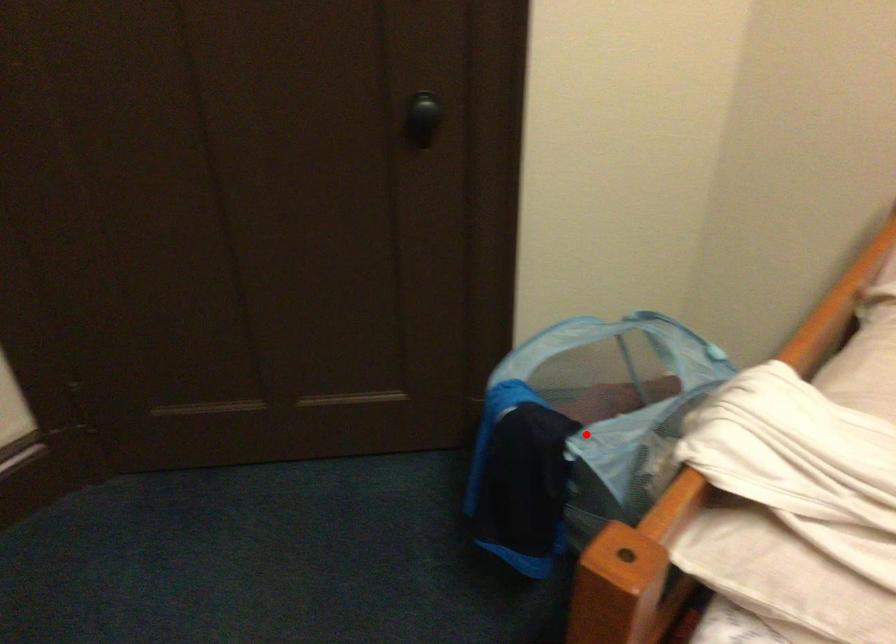
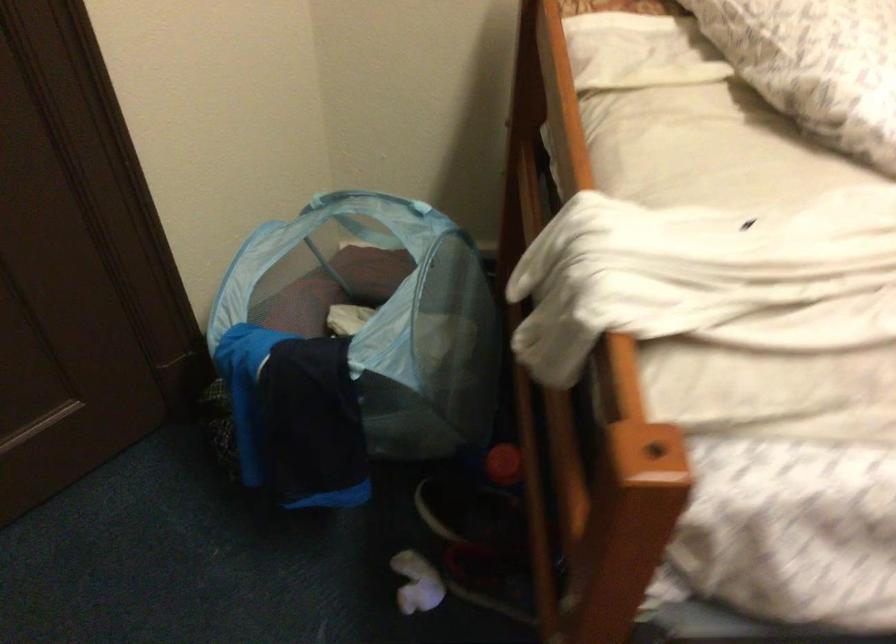
Question: I am providing you with two images of the same scene from different viewpoints. A red point is marked on the first image. Can you still see the location of the red point in image 2?

Choices:
 (A) Yes
 (B) No

Answer: (A)